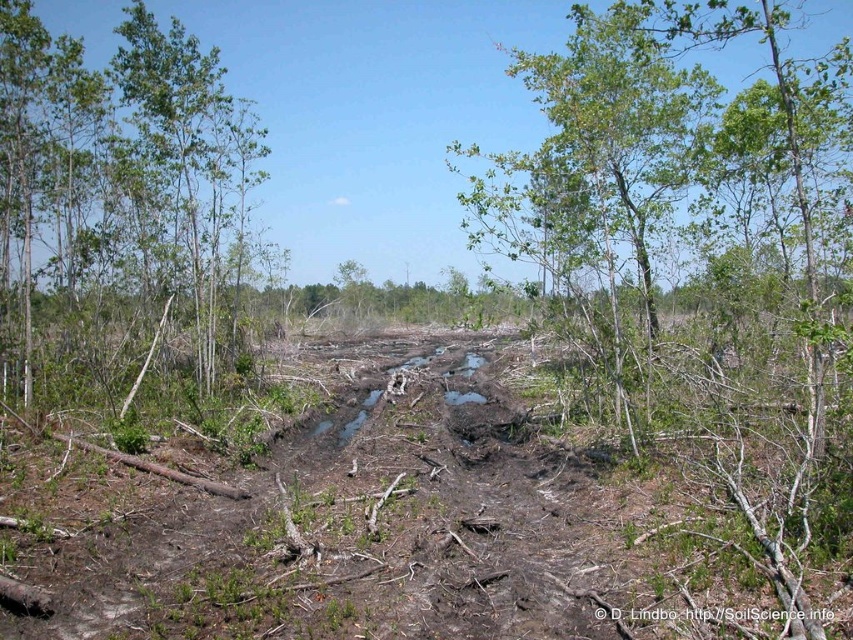
Question: Where is green leafy tree at center located in relation to green leafy tree at upper left in the image?

Choices:
 (A) below
 (B) above

Answer: (A)

Question: Is green leafy tree at center wider than green leafy tree at upper left?

Choices:
 (A) no
 (B) yes

Answer: (B)

Question: Does green leafy tree at center appear on the right side of green leafy tree at upper left?

Choices:
 (A) no
 (B) yes

Answer: (B)